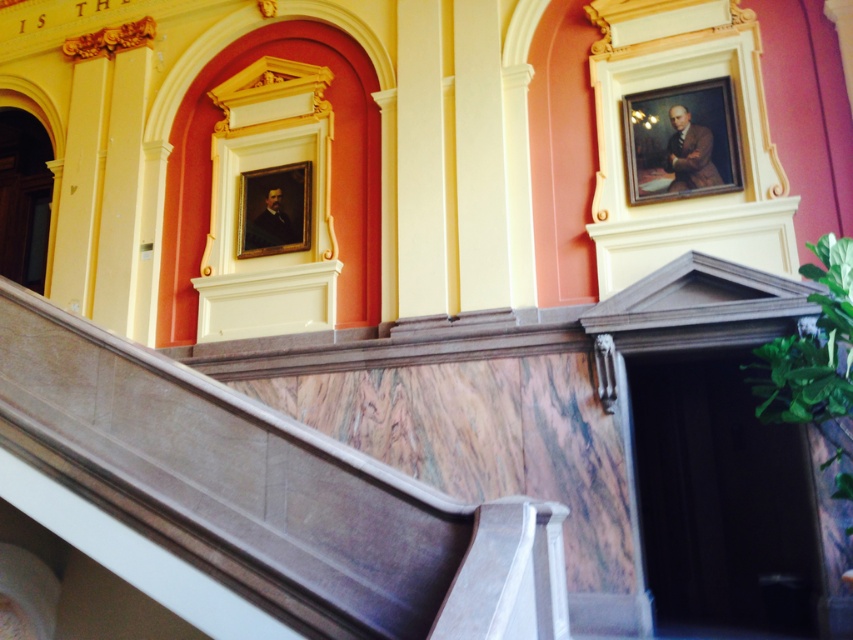
Is marble stairs at center taller than oil painting portrait at upper right?

Correct, marble stairs at center is much taller as oil painting portrait at upper right.

Is marble stairs at center to the right of oil painting portrait at upper right from the viewer's perspective?

Incorrect, marble stairs at center is not on the right side of oil painting portrait at upper right.

Is point (306, 582) positioned after point (645, 113)?

No, it is in front of (645, 113).

I want to click on marble stairs at center, so click(257, 500).

Which is below, marble stairs at center or matte gold frame at upper center?

marble stairs at center is below.

Is marble stairs at center above matte gold frame at upper center?

Incorrect, marble stairs at center is not positioned above matte gold frame at upper center.

Consider the image. Who is more distant from viewer, (248, 436) or (252, 214)?

The point (252, 214) is more distant.

You are a GUI agent. You are given a task and a screenshot of the screen. Output one action in this format:
    pyautogui.click(x=<x>, y=<y>)
    Task: Click on the marble stairs at center
    Image resolution: width=853 pixels, height=640 pixels.
    Given the screenshot: What is the action you would take?
    pyautogui.click(x=257, y=500)

Image resolution: width=853 pixels, height=640 pixels. What do you see at coordinates (680, 141) in the screenshot?
I see `oil painting portrait at upper right` at bounding box center [680, 141].

This screenshot has height=640, width=853. I want to click on oil painting portrait at upper right, so click(680, 141).

Measure the distance between oil painting portrait at upper right and camera.

oil painting portrait at upper right is 5.44 meters from camera.

Locate an element on the screen. oil painting portrait at upper right is located at coordinates (680, 141).